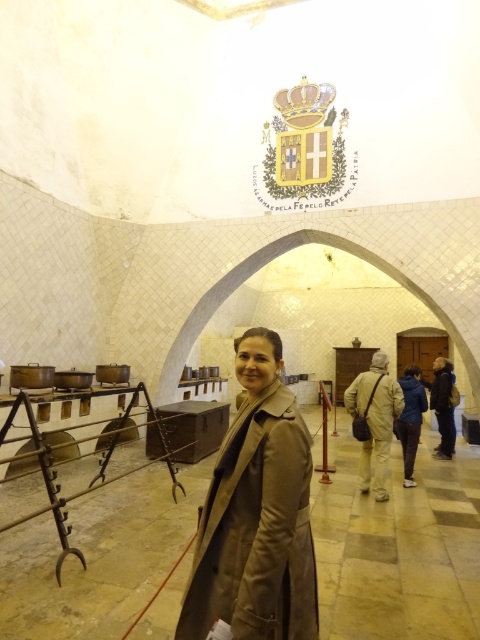
Question: Which of these objects is positioned closest to the beige leather coat at center?

Choices:
 (A) dark blue jacket at center
 (B) brown leather bag at center

Answer: (B)

Question: Can you confirm if beige leather coat at center is positioned to the left of khaki fabric pants at center?

Choices:
 (A) no
 (B) yes

Answer: (B)

Question: Is beige leather coat at center to the right of khaki fabric pants at center from the viewer's perspective?

Choices:
 (A) yes
 (B) no

Answer: (B)

Question: Which point is closer to the camera?

Choices:
 (A) beige leather coat at center
 (B) blue fabric jacket at center
 (C) khaki fabric pants at center

Answer: (A)

Question: Is tan leather coat at center further to camera compared to khaki fabric pants at center?

Choices:
 (A) no
 (B) yes

Answer: (A)

Question: Among these objects, which one is nearest to the camera?

Choices:
 (A) blue fabric jacket at center
 (B) khaki fabric pants at center

Answer: (B)